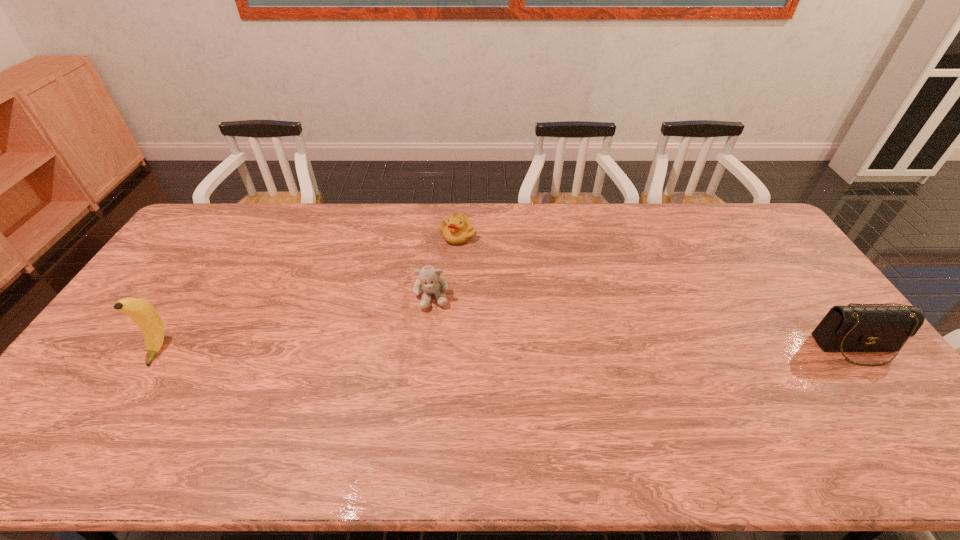
Image resolution: width=960 pixels, height=540 pixels. I want to click on vacant space at the right edge of the desktop, so click(x=800, y=292).

In the image, there is a desktop. Where is `vacant space at the near right corner`? The image size is (960, 540). vacant space at the near right corner is located at coordinates (848, 412).

The image size is (960, 540). I want to click on free space between the teddy bear and the farthest object, so click(x=445, y=266).

This screenshot has height=540, width=960. In order to click on unoccupied position between the rightmost object and the second farthest object in this screenshot , I will do `click(644, 322)`.

You are a GUI agent. You are given a task and a screenshot of the screen. Output one action in this format:
    pyautogui.click(x=<x>, y=<y>)
    Task: Click on the empty location between the third nearest object and the shortest object
    The width and height of the screenshot is (960, 540).
    Given the screenshot: What is the action you would take?
    pyautogui.click(x=445, y=266)

Where is `vacant area between the shortest object and the teddy bear`? vacant area between the shortest object and the teddy bear is located at coordinates 445,266.

Where is `empty space that is in between the clutch bag and the third nearest object`? empty space that is in between the clutch bag and the third nearest object is located at coordinates (x=644, y=322).

The height and width of the screenshot is (540, 960). I want to click on vacant space that is in between the leftmost object and the farthest object, so click(x=308, y=293).

This screenshot has height=540, width=960. I want to click on free space between the leftmost object and the second farthest object, so click(x=296, y=323).

Identify the location of vacant area that lies between the teddy bear and the rightmost object. click(644, 322).